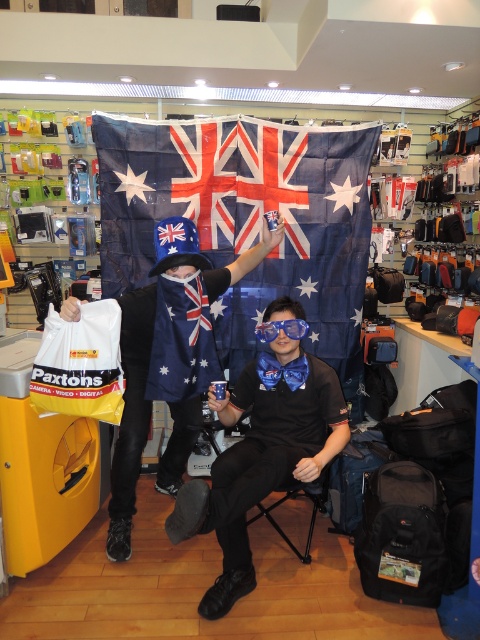
You are trying to decide whether to place a rectangular box that is 1 meter wide on a shelf between the matte black shirt at center and the blue glossy goggles at center. Based on the scene, can the box fit between them?

The matte black shirt at center might be wider than blue glossy goggles at center, so the space between them could be sufficient to fit the 1 meter wide box. However, since the exact width isn not specified, there is uncertainty. If the shirt is indeed wider, the box may fit, but if not, it might not. Please verify the actual dimensions before placing the box.

You are a customer in the store and want to place both the blue fabric flag at center and the blue glossy goggles at center into a single gift box. The gift box can only accommodate items up to the width of the wider object. Which object determines the minimum required width of the gift box?

The blue fabric flag at center has a greater width than the blue glossy goggles at center. Therefore, the minimum required width of the gift box must be at least the width of the blue fabric flag at center to accommodate both items.

You are a store employee who needs to determine if the matte black shirt at center can be placed inside the blue fabric hat at center. Based on their sizes, can the shirt fit inside the hat?

The matte black shirt at center has a smaller size compared to blue fabric hat at center, so the shirt can fit inside the hat.